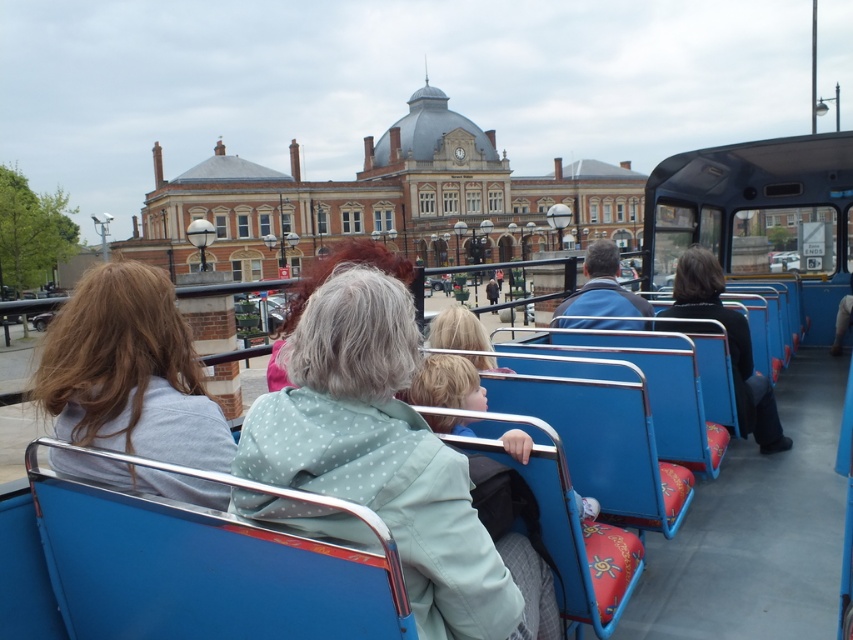
Can you confirm if light green polka dot jacket at center is bigger than light gray fabric jacket at center?

No, light green polka dot jacket at center is not bigger than light gray fabric jacket at center.

From the picture: Is light green polka dot jacket at center above light gray fabric jacket at center?

Incorrect, light green polka dot jacket at center is not positioned above light gray fabric jacket at center.

Does point (479, 612) lie behind point (85, 454)?

No.

Identify the location of light green polka dot jacket at center. The height and width of the screenshot is (640, 853). (392, 461).

Can you confirm if light gray fabric jacket at center is positioned below blue fabric coach at center?

No, light gray fabric jacket at center is not below blue fabric coach at center.

Is light gray fabric jacket at center taller than blue fabric coach at center?

Yes, light gray fabric jacket at center is taller than blue fabric coach at center.

At what (x,y) coordinates should I click in order to perform the action: click on light gray fabric jacket at center. Please return your answer as a coordinate pair (x, y). Looking at the image, I should click on (129, 372).

Find the location of `light gray fabric jacket at center`. light gray fabric jacket at center is located at coordinates (129, 372).

Which of these two, light gray fabric jacket at center or black fabric jacket at right, stands taller?

light gray fabric jacket at center

Is point (128, 426) in front of point (746, 381)?

Yes, it is in front of point (746, 381).

Locate an element on the screen. The height and width of the screenshot is (640, 853). light gray fabric jacket at center is located at coordinates (129, 372).

The width and height of the screenshot is (853, 640). What are the coordinates of `light gray fabric jacket at center` in the screenshot? It's located at (129, 372).